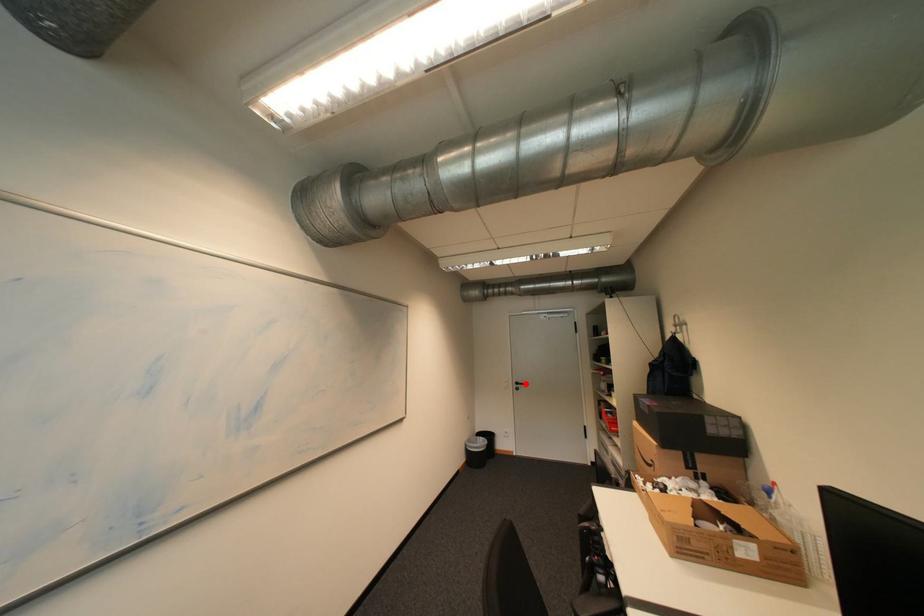
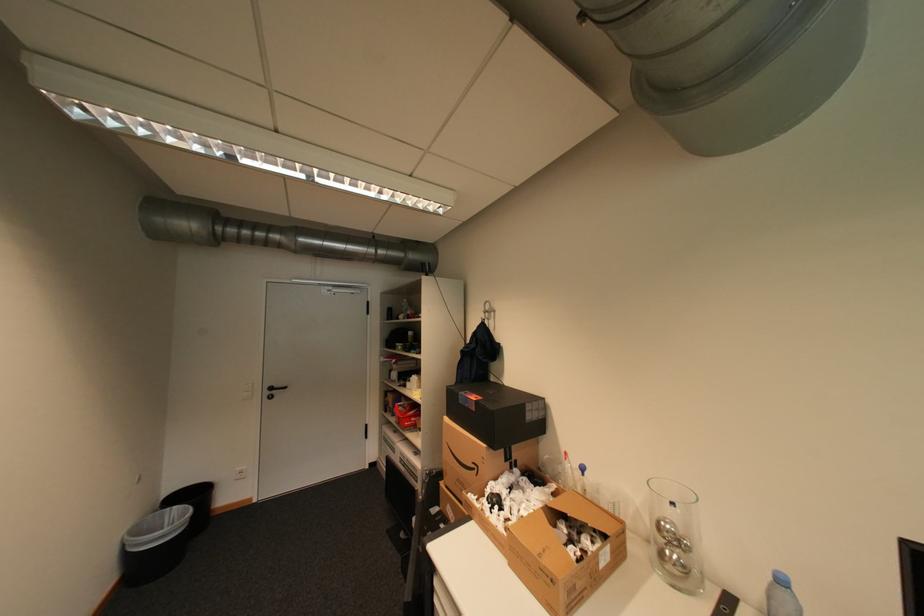
Find the pixel in the second image that matches the highlighted location in the first image.

(280, 389)